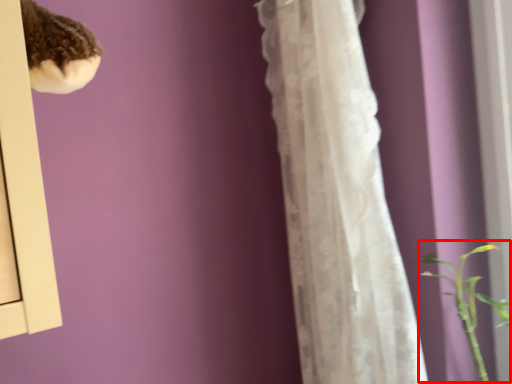
Question: From the image's perspective, considering the relative positions of orchid (annotated by the red box) and curtain in the image provided, where is orchid (annotated by the red box) located with respect to the staircase?

Choices:
 (A) above
 (B) below

Answer: (B)